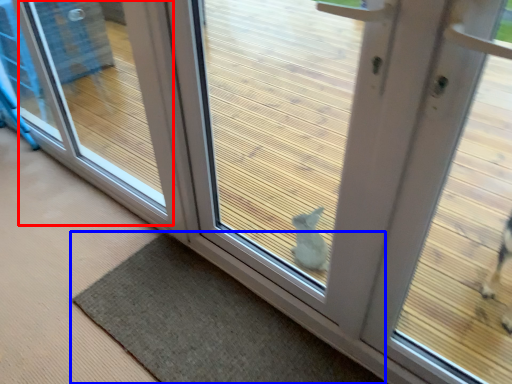
Question: Which object appears farthest to the camera in this image, window (highlighted by a red box) or mat (highlighted by a blue box)?

Choices:
 (A) window
 (B) mat

Answer: (A)